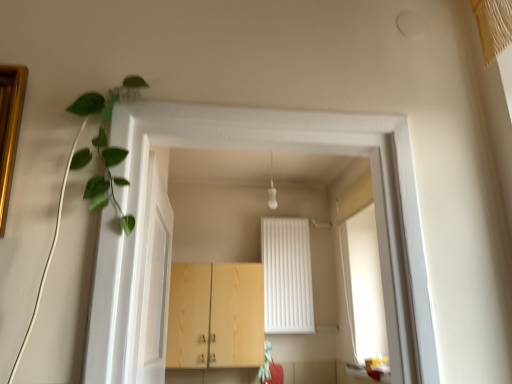
Question: From a real-world perspective, is white glossy door at left physically located above or below light wood cabinet at center?

Choices:
 (A) below
 (B) above

Answer: (B)

Question: Relative to light wood cabinet at center, is white glossy door at left in front or behind?

Choices:
 (A) behind
 (B) front

Answer: (B)

Question: Estimate the real-world distances between objects in this image. Which object is closer to the green leafy plant at upper left?

Choices:
 (A) light wood cabinet at center
 (B) white glossy door at left

Answer: (B)

Question: Based on their relative distances, which object is farther from the light wood cabinet at center?

Choices:
 (A) green leafy plant at upper left
 (B) white glossy door at left

Answer: (A)